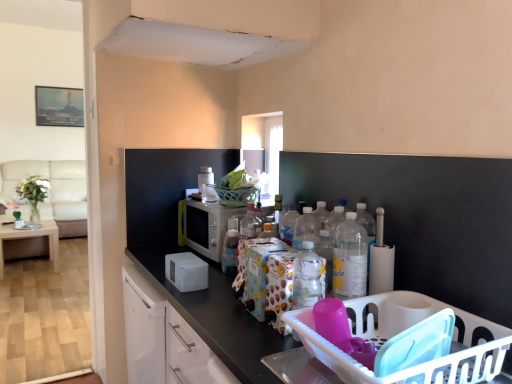
How much space does silver metallic microwave at center, the first appliance in the bottom-to-top sequence, occupy vertically?

The height of silver metallic microwave at center, the first appliance in the bottom-to-top sequence, is 25.85 centimeters.

This screenshot has width=512, height=384. Describe the element at coordinates (206, 226) in the screenshot. I see `silver metallic microwave at center, the first appliance in the bottom-to-top sequence` at that location.

The width and height of the screenshot is (512, 384). What do you see at coordinates (205, 177) in the screenshot?
I see `white plastic toaster at upper center, the 2th appliance from the bottom` at bounding box center [205, 177].

What do you see at coordinates (53, 191) in the screenshot? I see `beige fabric couch at left` at bounding box center [53, 191].

Image resolution: width=512 pixels, height=384 pixels. Describe the element at coordinates (230, 251) in the screenshot. I see `translucent plastic bottle at center, the second bottle viewed from the right` at that location.

In order to face green leafy plant in clear vase at left, should I rotate leftwards or rightwards?

Rotate your view left by about 27.366°.

Locate an element on the screen. This screenshot has width=512, height=384. clear plastic bottle at center-right, acting as the second bottle starting from the left is located at coordinates (350, 259).

Is silver metallic microwave at center, positioned as the 2th appliance in top-to-bottom order, closer to camera compared to clear plastic bottle at center-right, which is the 1th bottle from right to left?

No, silver metallic microwave at center, positioned as the 2th appliance in top-to-bottom order, is further to the viewer.

From a real-world perspective, is silver metallic microwave at center, positioned as the 2th appliance in top-to-bottom order, positioned over clear plastic bottle at center-right, which appears as the 1th bottle when viewed from the front, based on gravity?

No, from a real-world perspective, silver metallic microwave at center, positioned as the 2th appliance in top-to-bottom order, is not above clear plastic bottle at center-right, which appears as the 1th bottle when viewed from the front.

Measure the distance between silver metallic microwave at center, positioned as the 2th appliance in top-to-bottom order, and clear plastic bottle at center-right, which is the 1th bottle from right to left.

The distance of silver metallic microwave at center, positioned as the 2th appliance in top-to-bottom order, from clear plastic bottle at center-right, which is the 1th bottle from right to left, is 31.41 inches.

Is point (216, 241) farther from viewer compared to point (336, 245)?

Yes.

Who is shorter, white plastic basket at lower right or white matte cabinet at center?

With less height is white plastic basket at lower right.

From the image's perspective, is white plastic basket at lower right located above white matte cabinet at center?

Yes, from the image's perspective, white plastic basket at lower right is above white matte cabinet at center.

Consider the image. How far apart are white plastic basket at lower right and white matte cabinet at center?

white plastic basket at lower right is 22.96 inches from white matte cabinet at center.

Is white plastic basket at lower right completely or partially outside of white matte cabinet at center?

Indeed, white plastic basket at lower right is completely outside white matte cabinet at center.

From the image's perspective, between beige fabric couch at left and green leafy plant in clear vase at left, which one is located above?

beige fabric couch at left, from the image's perspective.

From a real-world perspective, is beige fabric couch at left above or below green leafy plant in clear vase at left?

From a real-world perspective, beige fabric couch at left is physically below green leafy plant in clear vase at left.

In the image, is beige fabric couch at left positioned in front of or behind green leafy plant in clear vase at left?

Visually, beige fabric couch at left is located behind green leafy plant in clear vase at left.

Does beige fabric couch at left turn towards green leafy plant in clear vase at left?

Yes, beige fabric couch at left is oriented towards green leafy plant in clear vase at left.

Considering the relative sizes of translucent plastic bottle at center, the second bottle viewed from the right, and transparent glass window at center in the image provided, is translucent plastic bottle at center, the second bottle viewed from the right, taller than transparent glass window at center?

No.

Is translucent plastic bottle at center, the second bottle viewed from the right, inside the boundaries of transparent glass window at center, or outside?

translucent plastic bottle at center, the second bottle viewed from the right, is spatially situated outside transparent glass window at center.

Can you confirm if translucent plastic bottle at center, which appears as the 1th bottle when viewed from the back, is smaller than transparent glass window at center?

Correct, translucent plastic bottle at center, which appears as the 1th bottle when viewed from the back, occupies less space than transparent glass window at center.

Can we say translucent plastic bottle at center, which is the 1th bottle from left to right, lies outside beige fabric couch at left?

translucent plastic bottle at center, which is the 1th bottle from left to right, lies outside beige fabric couch at left's area.

Does translucent plastic bottle at center, which is the 1th bottle from left to right, have a smaller size compared to beige fabric couch at left?

Yes.

Is translucent plastic bottle at center, which appears as the 1th bottle when viewed from the back, wider or thinner than beige fabric couch at left?

translucent plastic bottle at center, which appears as the 1th bottle when viewed from the back, is thinner than beige fabric couch at left.

This screenshot has width=512, height=384. Find the location of `bottle that is the 1st one above the beige fabric couch at left (from a real-world perspective)`. bottle that is the 1st one above the beige fabric couch at left (from a real-world perspective) is located at coordinates (230, 251).

Would you say transparent glass window at center is inside or outside translucent plastic bottle at center, which appears as the 1th bottle when viewed from the back?

transparent glass window at center is located beyond the bounds of translucent plastic bottle at center, which appears as the 1th bottle when viewed from the back.

From a real-world perspective, is transparent glass window at center positioned under translucent plastic bottle at center, the second bottle viewed from the right, based on gravity?

Actually, transparent glass window at center is physically above translucent plastic bottle at center, the second bottle viewed from the right, in the real world.

Considering the positions of objects transparent glass window at center and translucent plastic bottle at center, which appears as the 1th bottle when viewed from the back, in the image provided, who is behind, transparent glass window at center or translucent plastic bottle at center, which appears as the 1th bottle when viewed from the back,?

Positioned behind is transparent glass window at center.

In terms of height, does white matte cabinet at center look taller or shorter compared to white plastic basket at lower right?

In the image, white matte cabinet at center appears to be taller than white plastic basket at lower right.

Consider the image. From a real-world perspective, which object stands above the other?

In real-world perspective, white plastic basket at lower right is above.

Identify the location of basket located on the right of white matte cabinet at center. This screenshot has height=384, width=512. (398, 332).

From the image's perspective, between white matte cabinet at center and white plastic basket at lower right, which one is located above?

white plastic basket at lower right is shown above in the image.

The height and width of the screenshot is (384, 512). Find the location of `the 1st bottle positioned below the silver metallic microwave at center, positioned as the 2th appliance in top-to-bottom order (from the image's perspective)`. the 1st bottle positioned below the silver metallic microwave at center, positioned as the 2th appliance in top-to-bottom order (from the image's perspective) is located at coordinates (350, 259).

Identify the location of basket that appears on the right of white matte cabinet at center. (398, 332).

Which object lies further to the anchor point silver metallic microwave at center, positioned as the 2th appliance in top-to-bottom order, clear plastic bottle at center-right, which appears as the 1th bottle when viewed from the front, or green leafy plant in clear vase at left?

green leafy plant in clear vase at left is positioned further to the anchor silver metallic microwave at center, positioned as the 2th appliance in top-to-bottom order.

Estimate the real-world distances between objects in this image. Which object is closer to transparent glass window at center, translucent plastic bottle at center, which is the 1th bottle from left to right, or white plastic toaster at upper center, the 2th appliance from the bottom?

Among the two, white plastic toaster at upper center, the 2th appliance from the bottom, is located nearer to transparent glass window at center.

Looking at the image, which one is located closer to clear plastic bottle at center-right, acting as the second bottle starting from the left, white matte cabinet at center or transparent glass window at center?

Among the two, white matte cabinet at center is located nearer to clear plastic bottle at center-right, acting as the second bottle starting from the left.

When comparing their distances from white plastic basket at lower right, does white matte cabinet at center or white plastic toaster at upper center, the 2th appliance from the bottom, seem closer?

white matte cabinet at center is closer to white plastic basket at lower right.

When comparing their distances from green leafy plant in clear vase at left, does white matte cabinet at center or light brown wooden table at left seem further?

Among the two, white matte cabinet at center is located further to green leafy plant in clear vase at left.

When comparing their distances from silver metallic microwave at center, positioned as the 2th appliance in top-to-bottom order, does clear plastic bottle at center-right, which is the 1th bottle from right to left, or white plastic toaster at upper center, the 2th appliance from the bottom, seem further?

Based on the image, clear plastic bottle at center-right, which is the 1th bottle from right to left, appears to be further to silver metallic microwave at center, positioned as the 2th appliance in top-to-bottom order.

Estimate the real-world distances between objects in this image. Which object is further from white matte cabinet at center, green leafy plant in clear vase at left or white plastic toaster at upper center, which is counted as the first appliance, starting from the top?

green leafy plant in clear vase at left is positioned further to the anchor white matte cabinet at center.

Looking at the image, which one is located closer to white matte cabinet at center, silver metallic microwave at center, positioned as the 2th appliance in top-to-bottom order, or translucent plastic bottle at center, which appears as the 1th bottle when viewed from the back?

Based on the image, translucent plastic bottle at center, which appears as the 1th bottle when viewed from the back, appears to be nearer to white matte cabinet at center.

You are a GUI agent. You are given a task and a screenshot of the screen. Output one action in this format:
    pyautogui.click(x=<x>, y=<y>)
    Task: Click on the appliance between transparent glass window at center and silver metallic microwave at center, the first appliance in the bottom-to-top sequence, in the vertical direction
    
    Given the screenshot: What is the action you would take?
    pos(205,177)

The image size is (512, 384). I want to click on appliance between light brown wooden table at left and silver metallic microwave at center, positioned as the 2th appliance in top-to-bottom order, from left to right, so click(x=205, y=177).

Locate an element on the screen. table between white plastic basket at lower right and beige fabric couch at left along the z-axis is located at coordinates (32, 237).

The width and height of the screenshot is (512, 384). Find the location of `plant located between silver metallic microwave at center, the first appliance in the bottom-to-top sequence, and beige fabric couch at left in the depth direction`. plant located between silver metallic microwave at center, the first appliance in the bottom-to-top sequence, and beige fabric couch at left in the depth direction is located at coordinates (34, 194).